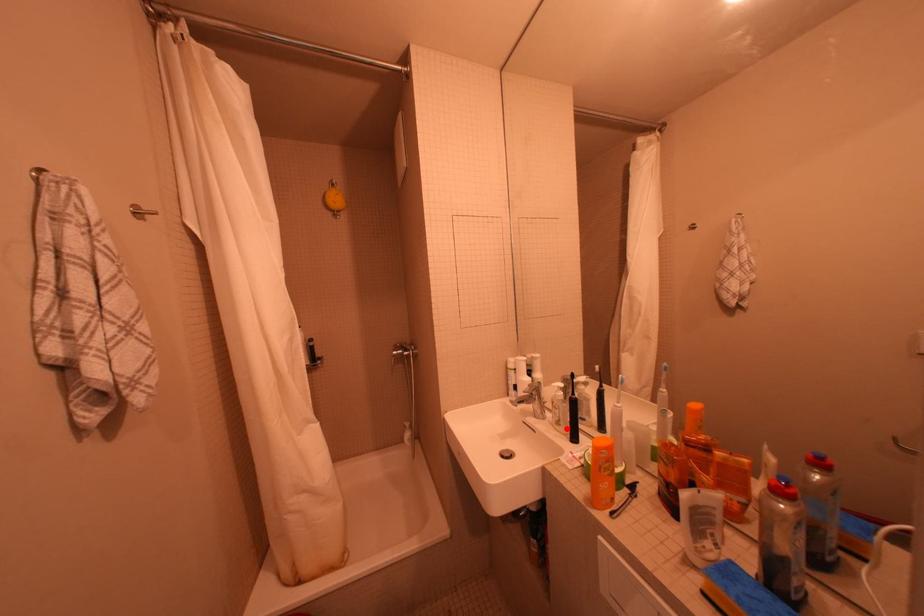
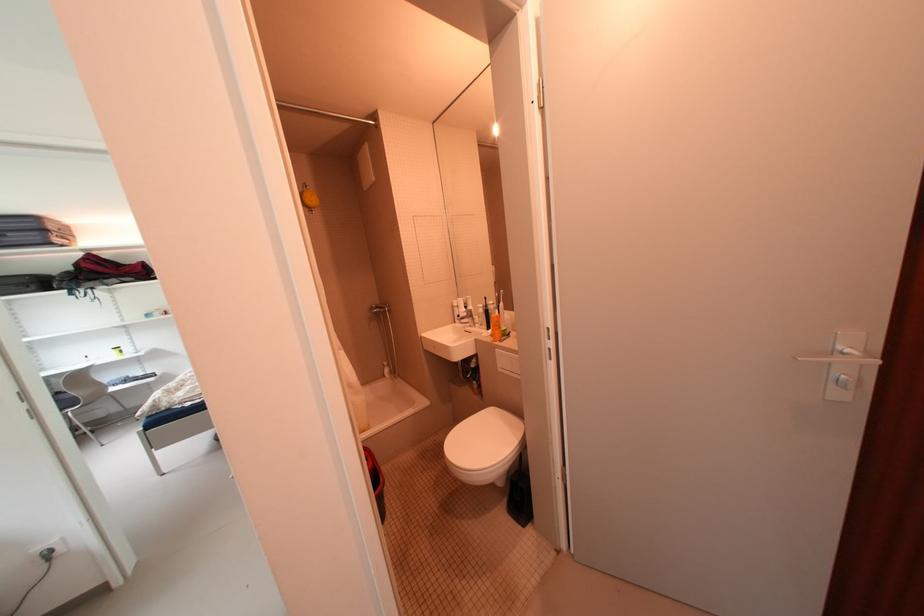
Where in the second image is the point corresponding to the highlighted location from the first image?

(490, 328)